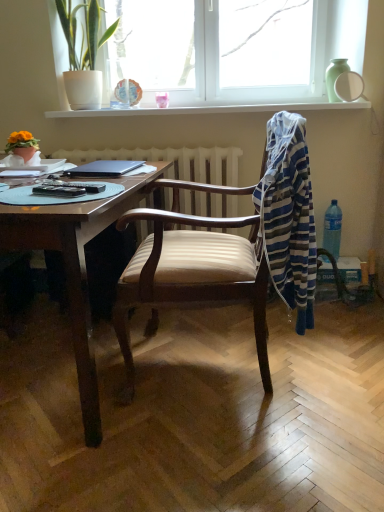
What do you see at coordinates (288, 216) in the screenshot?
I see `striped fabric at right` at bounding box center [288, 216].

Find the location of a particular element. Image resolution: width=384 pixels, height=512 pixels. wooden chair at center is located at coordinates (231, 248).

What do you see at coordinates (59, 190) in the screenshot? The width and height of the screenshot is (384, 512). I see `black plastic remote control at table left` at bounding box center [59, 190].

Looking at this image, in order to face white glass window at upper center, should I rotate leftwards or rightwards?

Turn right by 2.224 degrees to look at white glass window at upper center.

Locate an element on the screen. The width and height of the screenshot is (384, 512). green leafy plant at upper left, the 2th houseplant from the bottom is located at coordinates (83, 50).

This screenshot has height=512, width=384. What do you see at coordinates (75, 268) in the screenshot?
I see `wooden desk at center` at bounding box center [75, 268].

Where is `striped fabric at right`? Image resolution: width=384 pixels, height=512 pixels. striped fabric at right is located at coordinates (288, 216).

Can you see striped fabric at right touching wooden chair at center?

No, striped fabric at right is not next to wooden chair at center.

Which point is more distant from viewer, (291, 115) or (221, 301)?

The point (291, 115) is farther.

The width and height of the screenshot is (384, 512). I want to click on laundry located behind the wooden chair at center, so click(x=288, y=216).

Considering the positions of objects black matte laptop at upper left and white glass window at upper center in the image provided, who is behind, black matte laptop at upper left or white glass window at upper center?

white glass window at upper center.

Is black matte laptop at upper left thinner than white glass window at upper center?

Incorrect, the width of black matte laptop at upper left is not less than that of white glass window at upper center.

From the image's perspective, does black matte laptop at upper left appear lower than white glass window at upper center?

Correct, black matte laptop at upper left appears lower than white glass window at upper center in the image.

Considering the sizes of objects black plastic remote control at table left and striped fabric at right in the image provided, who is wider, black plastic remote control at table left or striped fabric at right?

With larger width is striped fabric at right.

From a real-world perspective, is black plastic remote control at table left under striped fabric at right?

No, from a real-world perspective, black plastic remote control at table left is not beneath striped fabric at right.

Is black plastic remote control at table left oriented away from striped fabric at right?

No, black plastic remote control at table left is not facing the opposite direction of striped fabric at right.

Is white glass window at upper center not inside wooden chair at center?

white glass window at upper center is positioned outside wooden chair at center.

Which point is more forward, (206, 62) or (306, 187)?

Point (306, 187)

From the image's perspective, is white glass window at upper center under wooden chair at center?

Incorrect, from the image's perspective, white glass window at upper center is higher than wooden chair at center.

Which object is positioned more to the left, white glass window at upper center or wooden chair at center?

From the viewer's perspective, wooden chair at center appears more on the left side.

Is green leafy plant at upper left, the 2th houseplant from the bottom, inside or outside of wooden chair at center?

green leafy plant at upper left, the 2th houseplant from the bottom, is located beyond the bounds of wooden chair at center.

How distant is green leafy plant at upper left, which is counted as the 1th houseplant, starting from the right, from wooden chair at center?

green leafy plant at upper left, which is counted as the 1th houseplant, starting from the right, is 1.15 meters from wooden chair at center.

Find the location of `chair below the green leafy plant at upper left, the second houseplant positioned from the front (from the image's perspective)`. chair below the green leafy plant at upper left, the second houseplant positioned from the front (from the image's perspective) is located at coordinates (231, 248).

In the scene shown: From a real-world perspective, who is located higher, green leafy plant at upper left, marked as the first houseplant in a back-to-front arrangement, or wooden chair at center?

From a 3D spatial view, green leafy plant at upper left, marked as the first houseplant in a back-to-front arrangement, is above.

The image size is (384, 512). I want to click on chair on the left of the white glossy shelf at upper center, so click(x=231, y=248).

Could you tell me if white glossy shelf at upper center is turned towards wooden chair at center?

No, white glossy shelf at upper center does not turn towards wooden chair at center.

Which of these two, white glossy shelf at upper center or wooden chair at center, is thinner?

white glossy shelf at upper center is thinner.

In terms of width, does striped fabric at right look wider or thinner when compared to black plastic remote control at table left?

striped fabric at right is wider than black plastic remote control at table left.

This screenshot has height=512, width=384. What are the coordinates of `remote control that is above the striped fabric at right (from a real-world perspective)` in the screenshot? It's located at (59, 190).

Who is shorter, striped fabric at right or black plastic remote control at table left?

With less height is black plastic remote control at table left.

Based on the photo, from a real-world perspective, which object rests below the other?

striped fabric at right.

This screenshot has width=384, height=512. Identify the location of laundry above the wooden chair at center (from a real-world perspective). (288, 216).

You are a GUI agent. You are given a task and a screenshot of the screen. Output one action in this format:
    pyautogui.click(x=<x>, y=<y>)
    Task: Click on the laptop in front of the white glass window at upper center
    The height and width of the screenshot is (512, 384).
    Given the screenshot: What is the action you would take?
    pyautogui.click(x=104, y=168)

From the image, which object appears to be nearer to matte orange flower pot at lower left, acting as the second houseplant starting from the right, wooden desk at center or white glass window at upper center?

wooden desk at center is positioned closer to the anchor matte orange flower pot at lower left, acting as the second houseplant starting from the right.

Looking at the image, which one is located closer to white glossy shelf at upper center, matte orange flower pot at lower left, the 1th houseplant when ordered from front to back, or wooden desk at center?

matte orange flower pot at lower left, the 1th houseplant when ordered from front to back, is closer to white glossy shelf at upper center.

When comparing their distances from white glossy mirror at upper right, does clear plastic bottle at right or green leafy plant at upper left, the second houseplant positioned from the front, seem further?

Among the two, green leafy plant at upper left, the second houseplant positioned from the front, is located further to white glossy mirror at upper right.

Based on the photo, looking at the image, which one is located closer to white glossy mirror at upper right, wooden desk at center or green leafy plant at upper left, which is counted as the 1th houseplant, starting from the right?

Based on the image, green leafy plant at upper left, which is counted as the 1th houseplant, starting from the right, appears to be nearer to white glossy mirror at upper right.

Based on their spatial positions, is black plastic remote control at table left or clear plastic bottle at right further from white glossy shelf at upper center?

black plastic remote control at table left is further to white glossy shelf at upper center.

From the image, which object appears to be nearer to clear plastic bottle at right, matte orange flower pot at lower left, placed as the 2th houseplant when sorted from top to bottom, or black plastic remote control at table left?

Among the two, black plastic remote control at table left is located nearer to clear plastic bottle at right.

When comparing their distances from black matte laptop at upper left, does green leafy plant at upper left, which is counted as the 1th houseplant, starting from the right, or white textured radiator at center seem closer?

Among the two, white textured radiator at center is located nearer to black matte laptop at upper left.

From the picture: Considering their positions, is wooden chair at center positioned further to black matte laptop at upper left than wooden desk at center?

The object further to black matte laptop at upper left is wooden chair at center.

Find the location of a particular element. laptop between matte orange flower pot at lower left, the first houseplant from the bottom, and white textured radiator at center from left to right is located at coordinates (104, 168).

Find the location of a particular element. remote control between green leafy plant at upper left, marked as the first houseplant in a back-to-front arrangement, and wooden desk at center vertically is located at coordinates (59, 190).

Where is `mirror between white glass window at upper center and clear plastic bottle at right from top to bottom`? This screenshot has width=384, height=512. mirror between white glass window at upper center and clear plastic bottle at right from top to bottom is located at coordinates (349, 86).

Find the location of a particular element. The width and height of the screenshot is (384, 512). laptop between matte orange flower pot at lower left, which is the first houseplant in left-to-right order, and clear plastic bottle at right is located at coordinates (104, 168).